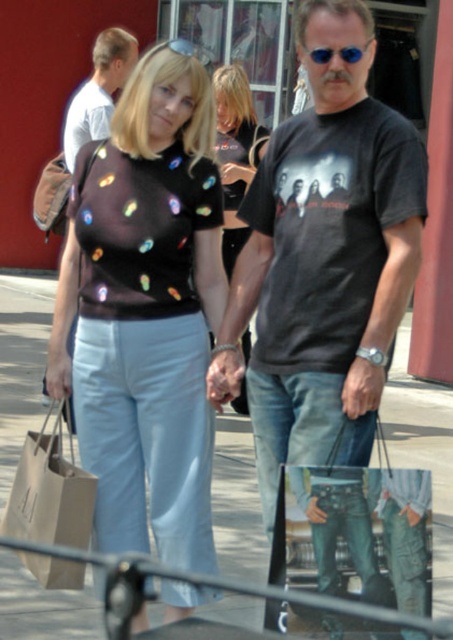
Question: Estimate the real-world distances between objects in this image. Which object is farther from the blue reflective sunglasses at center?

Choices:
 (A) light brown hair at upper left
 (B) brown paper bag at lower left
 (C) light gray concrete sidewalk at center

Answer: (A)

Question: Which point is farther to the camera?

Choices:
 (A) (316, 65)
 (B) (260, 372)
 (C) (120, 232)

Answer: (C)

Question: Among these points, which one is farthest from the camera?

Choices:
 (A) (81, 436)
 (B) (443, 449)
 (C) (379, 208)

Answer: (B)

Question: Where is matte black blouse at center located in relation to light blue denim jeans at lower center in the image?

Choices:
 (A) above
 (B) below

Answer: (A)

Question: Is light gray concrete sidewalk at center to the right of light brown hair at upper left from the viewer's perspective?

Choices:
 (A) yes
 (B) no

Answer: (A)

Question: Is denim at center above blue reflective sunglasses at center?

Choices:
 (A) no
 (B) yes

Answer: (A)